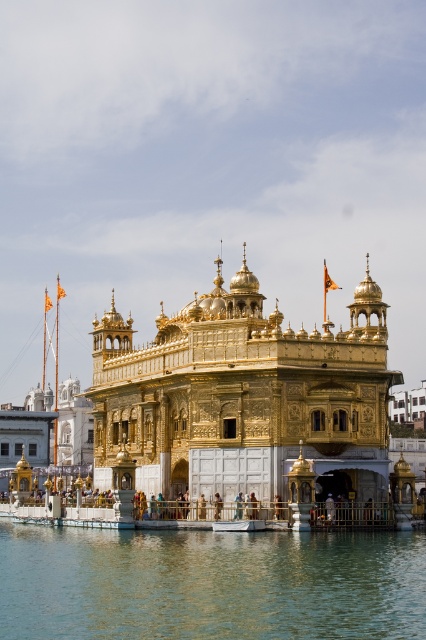
You are standing in front of the Golden Temple and want to take a photo. You notice two points marked in the scene. The first point is at coordinates point (x=377, y=428) and the second point is at point (x=2, y=540). Which of these points is closer to your current position?

Point (x=377, y=428) is closer to the camera than point (x=2, y=540), so the first point is closer to your current position.

You are a tourist visiting the Golden Temple and want to take a photo of the golden ornate temple at center with the clear water at lower center in the foreground. Which object should be placed closer to the camera to include both in the frame?

To include both the golden ornate temple at center and the clear water at lower center in the frame, the clear water at lower center should be placed closer to the camera since it is positioned on the left side of the golden ornate temple at center.